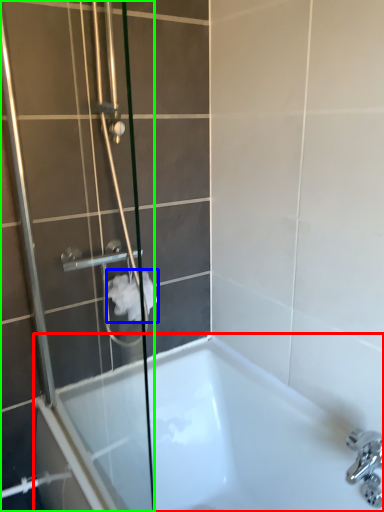
Question: Based on their relative distances, which object is nearer to bathtub (highlighted by a red box)? Choose from toilet paper (highlighted by a blue box) and shower door (highlighted by a green box).

Choices:
 (A) toilet paper
 (B) shower door

Answer: (B)